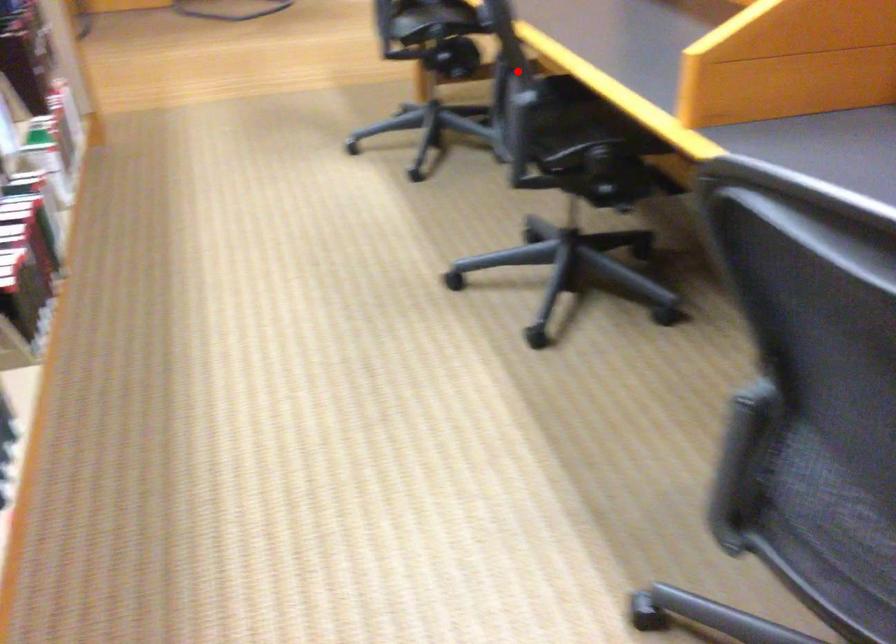
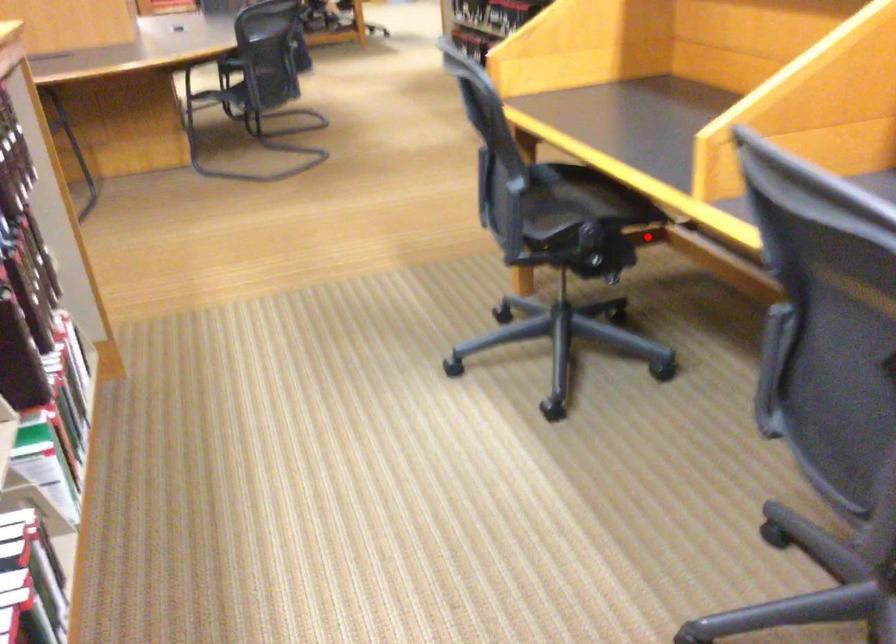
I am providing you with two images of the same scene from different viewpoints. A red point is marked on the first image and another point is marked on the second image. Are the points marked in image1 and image2 representing the same 3D position?

No